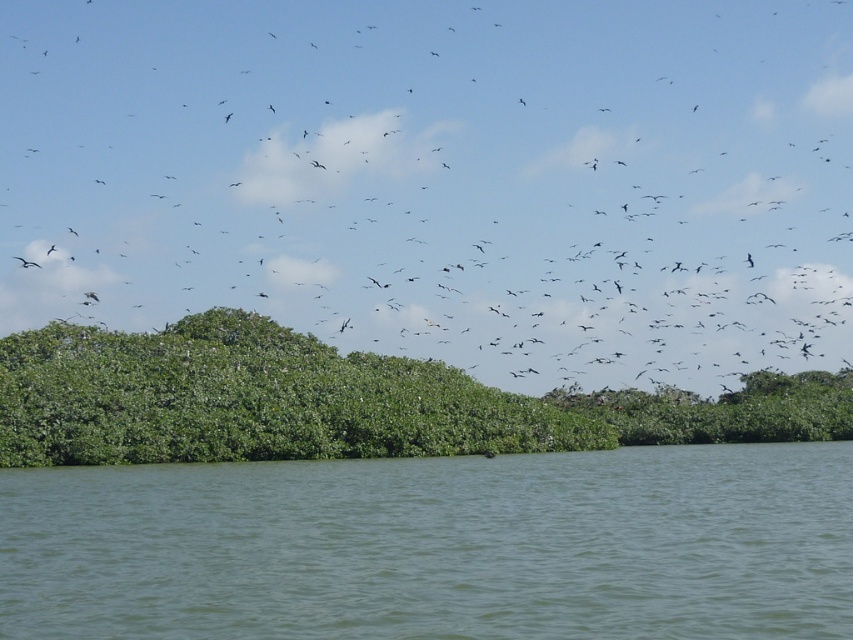
You are standing at the edge of the scene and want to reach the middle of the water. Which direction should you move relative to the green liquid water at lower center?

The green liquid water at lower center is located at point [436,547], so you should move towards the center of the water area to reach the middle.

You are an ornithologist observing a black matte bird at center in a serene natural scene with a body of water and dense vegetation. Based on its position, can you determine if the bird is closer to the water or the vegetation?

The black matte bird at center is located at coordinates 0.280 on the x and 0.519 on the y axis. Since the water is in the foreground and the vegetation is in the middle ground, the bird is closer to the water.

You are standing at the point marked by point (x=436, y=547) in the scene. What type of surface are you currently standing on?

You are standing on green liquid water at lower center, which is represented by the point (x=436, y=547).